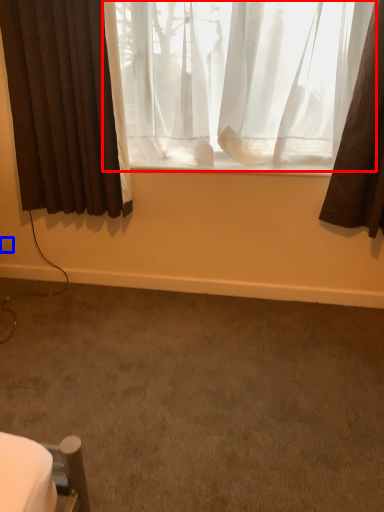
Question: Among these objects, which one is farthest to the camera, curtain (highlighted by a red box) or electric outlet (highlighted by a blue box)?

Choices:
 (A) curtain
 (B) electric outlet

Answer: (B)